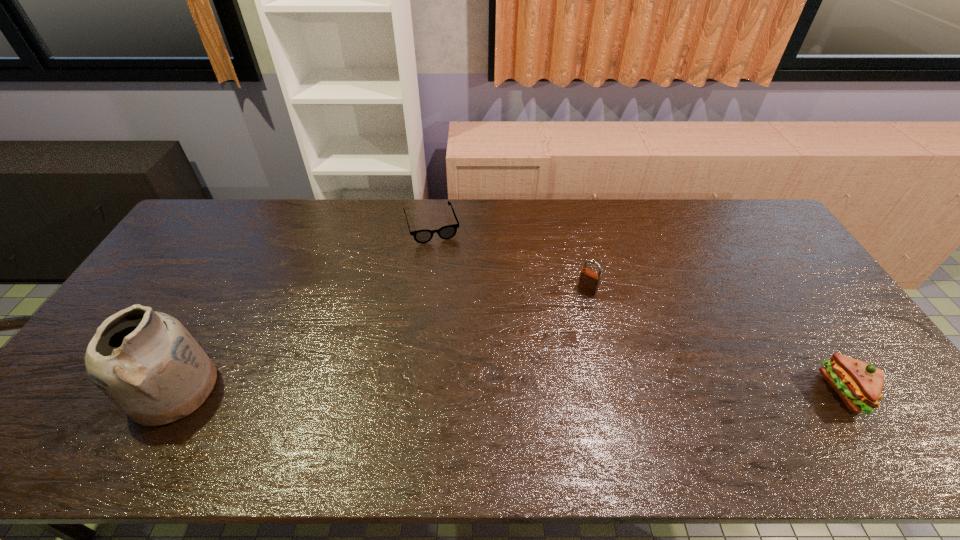
This screenshot has width=960, height=540. In order to click on vacant space that satisfies the following two spatial constraints: 1. on the front side of the third object from right to left; 2. on the left side of the second farthest object in this screenshot , I will do `click(423, 289)`.

Identify the location of free region that satisfies the following two spatial constraints: 1. on the back side of the second object from right to left; 2. on the right side of the leftmost object. The image size is (960, 540). (229, 289).

Identify the location of vacant space that satisfies the following two spatial constraints: 1. on the front side of the sandwich; 2. on the right side of the third nearest object. Image resolution: width=960 pixels, height=540 pixels. (x=612, y=392).

Image resolution: width=960 pixels, height=540 pixels. In order to click on vacant point that satisfies the following two spatial constraints: 1. on the front side of the third nearest object; 2. on the left side of the shortest object in this screenshot , I will do `click(423, 289)`.

Find the location of a particular element. The image size is (960, 540). vacant region that satisfies the following two spatial constraints: 1. on the front side of the sandwich; 2. on the left side of the leftmost object is located at coordinates (173, 392).